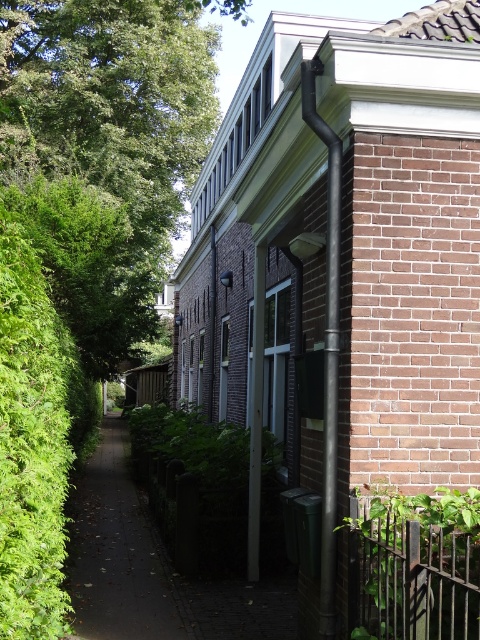
You are a delivery person trying to navigate a narrow alleyway. You need to deliver a package to the entrance of the red brick building on the right. The entrance is partially shaded by an overhang with two metal poles. There is a dark brown paved path at center and a black matte pipe at upper right. Which object should you avoid stepping on to ensure you don not damage the package?

The dark brown paved path at center has a larger size compared to the black matte pipe at upper right, so you should avoid stepping on the black matte pipe at upper right to prevent damaging the package since it is smaller and possibly more fragile.

You are a delivery person trying to navigate through the alleyway. You need to pass by the black metal fence at lower right and the black matte pipe at upper right. Which object should you avoid hitting your head on?

The black matte pipe at upper right is lower than the black metal fence at lower right, so you should avoid hitting your head on the black matte pipe at upper right.